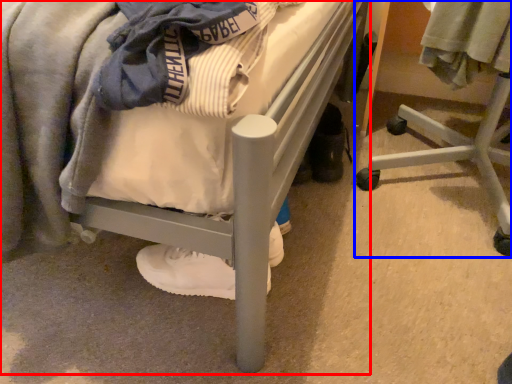
Question: Among these objects, which one is nearest to the camera, bed (highlighted by a red box) or furniture (highlighted by a blue box)?

Choices:
 (A) bed
 (B) furniture

Answer: (A)